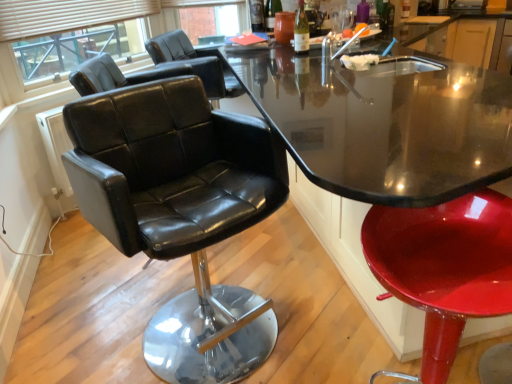
Question: Considering the relative sizes of glossy black table at center and black leather chairs at upper left in the image provided, is glossy black table at center smaller than black leather chairs at upper left?

Choices:
 (A) yes
 (B) no

Answer: (B)

Question: Is glossy black table at center not inside black leather chairs at upper left?

Choices:
 (A) yes
 (B) no

Answer: (A)

Question: Is glossy black table at center behind black leather chairs at upper left?

Choices:
 (A) yes
 (B) no

Answer: (B)

Question: Could black leather chairs at upper left be considered to be inside glossy black table at center?

Choices:
 (A) no
 (B) yes

Answer: (A)

Question: From the image's perspective, would you say glossy black table at center is positioned over black leather chairs at upper left?

Choices:
 (A) no
 (B) yes

Answer: (A)

Question: Is glossy black table at center next to black leather chairs at upper left and touching it?

Choices:
 (A) yes
 (B) no

Answer: (B)

Question: Is glossy black table at center completely or partially inside black leather chairs at upper left?

Choices:
 (A) yes
 (B) no

Answer: (B)

Question: Is black leather chairs at upper left in contact with glossy black table at center?

Choices:
 (A) yes
 (B) no

Answer: (B)

Question: Can you confirm if black leather chairs at upper left is taller than glossy black table at center?

Choices:
 (A) no
 (B) yes

Answer: (A)

Question: Can you confirm if black leather chairs at upper left is positioned to the right of glossy black table at center?

Choices:
 (A) no
 (B) yes

Answer: (A)

Question: Is black leather chairs at upper left not within glossy black table at center?

Choices:
 (A) no
 (B) yes

Answer: (B)

Question: Is black leather chairs at upper left not near glossy black table at center?

Choices:
 (A) yes
 (B) no

Answer: (A)

Question: Does black leather chair at left, which is the second chair from front to back, touch glossy red stool at lower right, which is counted as the third chair, starting from the back?

Choices:
 (A) no
 (B) yes

Answer: (A)